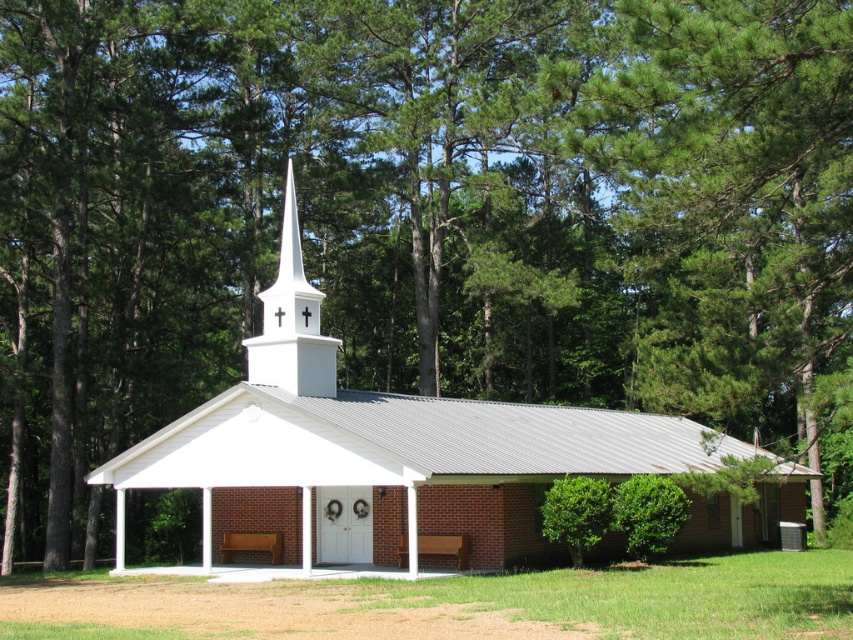
Does point (260, 298) come in front of point (407, 538)?

No, it is not.

Does white matte steeple at center lie behind wooden bench at center?

Yes, it is.

Is point (323, 349) farther from camera compared to point (461, 538)?

Yes, point (323, 349) is farther from viewer.

Find the location of a particular element. This screenshot has width=853, height=640. white matte steeple at center is located at coordinates (291, 323).

Can you confirm if white brick church at center is positioned above brown wooden bench at lower center?

Correct, white brick church at center is located above brown wooden bench at lower center.

Who is taller, white brick church at center or brown wooden bench at lower center?

With more height is white brick church at center.

Is point (378, 458) positioned behind point (253, 536)?

That is False.

Find the location of a particular element. The image size is (853, 640). white brick church at center is located at coordinates (407, 456).

Who is shorter, white brick church at center or wooden bench at center?

Standing shorter between the two is wooden bench at center.

Is white brick church at center behind wooden bench at center?

No, it is not.

The width and height of the screenshot is (853, 640). What do you see at coordinates (407, 456) in the screenshot?
I see `white brick church at center` at bounding box center [407, 456].

This screenshot has height=640, width=853. What are the coordinates of `white brick church at center` in the screenshot? It's located at (407, 456).